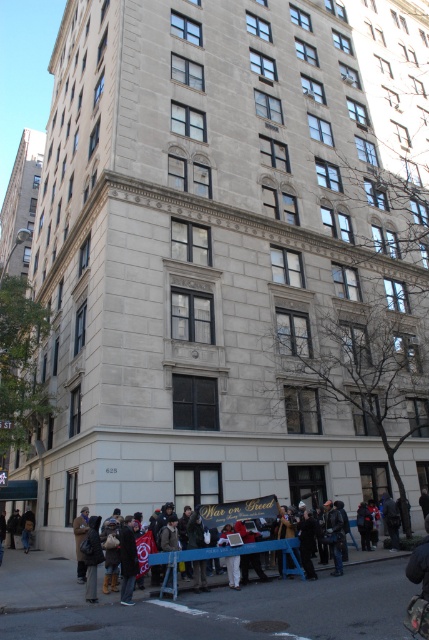
Measure the distance between white cotton shirt at lower center and camera.

The distance of white cotton shirt at lower center from camera is 77.81 feet.

Between white cotton shirt at lower center and dark brown leather jacket at lower left, which one is positioned lower?

dark brown leather jacket at lower left is below.

Does point (187, 563) come behind point (23, 525)?

No, (187, 563) is closer to viewer.

Locate an element on the screen. This screenshot has height=640, width=429. white cotton shirt at lower center is located at coordinates (217, 552).